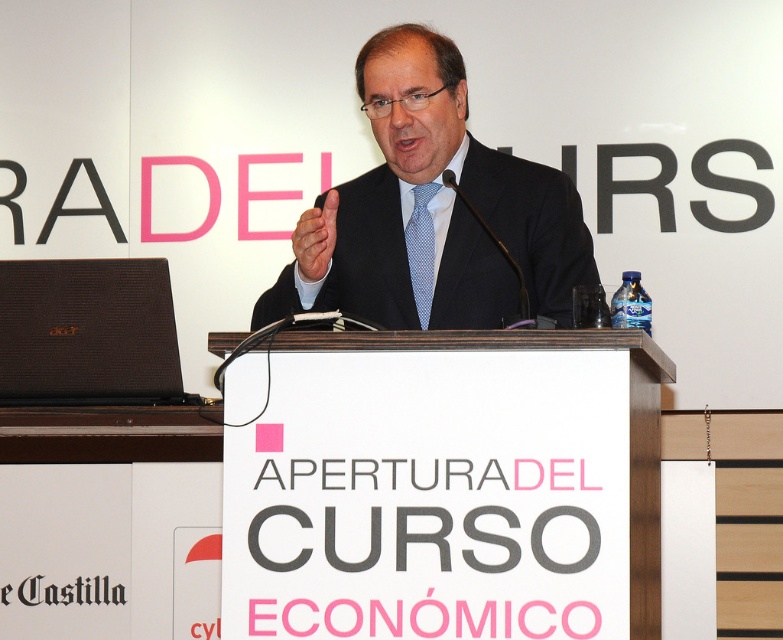
Question: Does dark blue suit at center lie behind brown textured laptop at left?

Choices:
 (A) yes
 (B) no

Answer: (B)

Question: Does dark blue suit at center appear on the left side of brown textured laptop at left?

Choices:
 (A) yes
 (B) no

Answer: (B)

Question: Considering the relative positions of dark blue suit at center and brown textured laptop at left in the image provided, where is dark blue suit at center located with respect to brown textured laptop at left?

Choices:
 (A) below
 (B) above

Answer: (B)

Question: Which point is farther to the camera?

Choices:
 (A) brown textured laptop at left
 (B) dark blue suit at center

Answer: (A)

Question: Which point appears farthest from the camera in this image?

Choices:
 (A) (74, 403)
 (B) (323, 195)

Answer: (B)